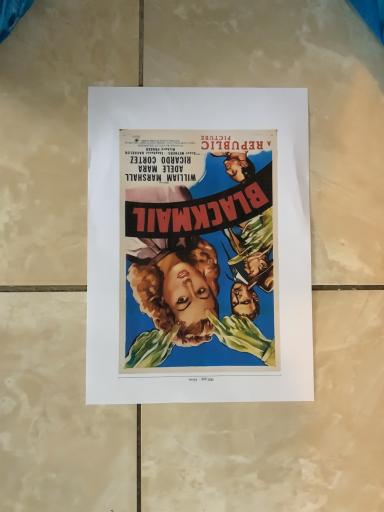
I want to click on free point above matte paper poster at center (from a real-world perspective), so click(x=200, y=241).